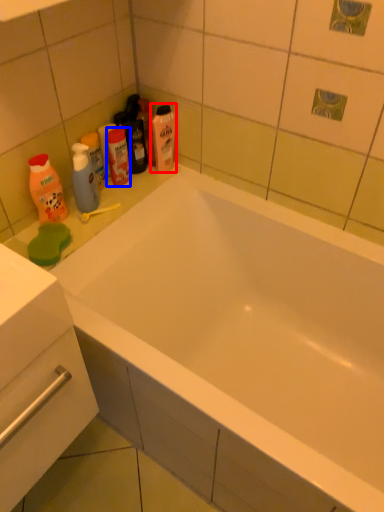
Question: Which of the following is the closest to the observer, cleaning product (highlighted by a red box) or mouthwash (highlighted by a blue box)?

Choices:
 (A) cleaning product
 (B) mouthwash

Answer: (B)